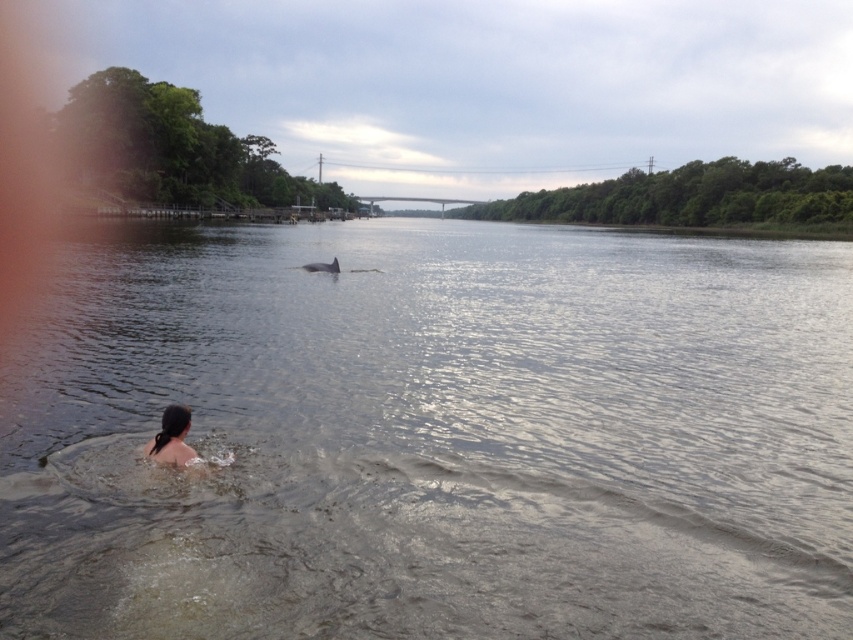
Question: Which of the following is the closest to the observer?

Choices:
 (A) (178, 465)
 (B) (314, 424)

Answer: (A)

Question: Which point is farther to the camera?

Choices:
 (A) (804, 244)
 (B) (166, 456)

Answer: (A)

Question: In this image, where is clear water at center located relative to dark hair at lower left?

Choices:
 (A) above
 (B) below

Answer: (A)

Question: Does clear water at center lie in front of dark hair at lower left?

Choices:
 (A) yes
 (B) no

Answer: (A)

Question: Observing the image, what is the correct spatial positioning of clear water at center in reference to dark hair at lower left?

Choices:
 (A) left
 (B) right

Answer: (B)